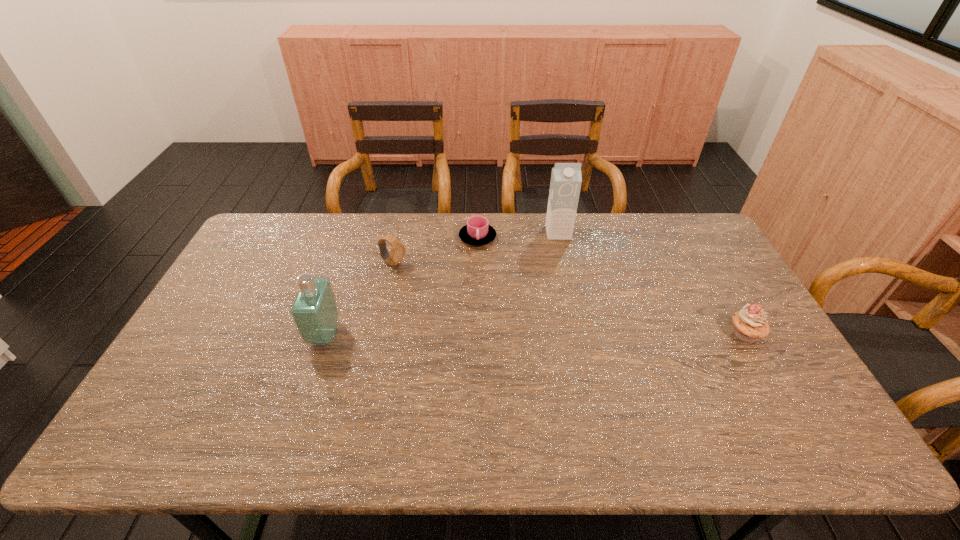
Where is `free region located 0.310m on the side with the handle of the cup`? free region located 0.310m on the side with the handle of the cup is located at coordinates (515, 312).

The height and width of the screenshot is (540, 960). Identify the location of free space located on the side with the handle of the cup. (511, 305).

Find the location of a particular element. Image resolution: width=960 pixels, height=540 pixels. carton present at the far edge is located at coordinates (566, 179).

Image resolution: width=960 pixels, height=540 pixels. What are the coordinates of `cup that is at the far edge` in the screenshot? It's located at (477, 232).

Where is `object at the right edge`? The image size is (960, 540). object at the right edge is located at coordinates (750, 324).

You are a GUI agent. You are given a task and a screenshot of the screen. Output one action in this format:
    pyautogui.click(x=<x>, y=<y>)
    Task: Click on the vacant space at the far edge
    The width and height of the screenshot is (960, 540).
    Given the screenshot: What is the action you would take?
    pyautogui.click(x=604, y=224)

I want to click on vacant area at the near edge of the desktop, so click(512, 401).

You are a GUI agent. You are given a task and a screenshot of the screen. Output one action in this format:
    pyautogui.click(x=<x>, y=<y>)
    Task: Click on the vacant area at the left edge of the desktop
    
    Given the screenshot: What is the action you would take?
    pyautogui.click(x=245, y=334)

Locate an element on the screen. This screenshot has height=540, width=960. blank space at the right edge of the desktop is located at coordinates (703, 280).

You are a GUI agent. You are given a task and a screenshot of the screen. Output one action in this format:
    pyautogui.click(x=<x>, y=<y>)
    Task: Click on the vacant space at the near left corner
    The width and height of the screenshot is (960, 540).
    Given the screenshot: What is the action you would take?
    pyautogui.click(x=207, y=396)